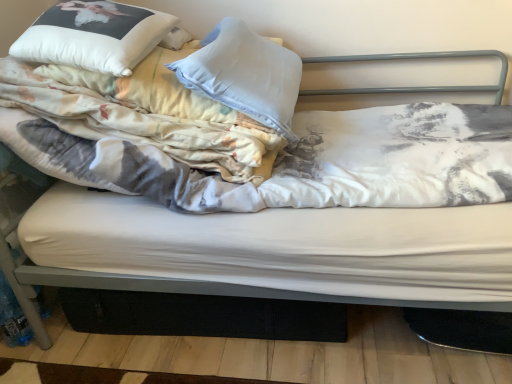
In order to face white soft pillow at upper left, acting as the 2th pillow starting from the left, should I rotate leftwards or rightwards?

Turn left by 0.674 degrees to look at white soft pillow at upper left, acting as the 2th pillow starting from the left.

Where is `printed cotton blanket at left`? This screenshot has height=384, width=512. printed cotton blanket at left is located at coordinates (145, 114).

Find the location of a particular element. The image size is (512, 384). white soft pillow at upper left, which is the 1th pillow from left to right is located at coordinates (93, 35).

Is white soft pillow at upper left, acting as the 2th pillow starting from the left, positioned far away from white soft pillow at upper left, which is the 2th pillow from right to left?

white soft pillow at upper left, acting as the 2th pillow starting from the left, is near white soft pillow at upper left, which is the 2th pillow from right to left, not far away.

Which object is positioned more to the left, white soft pillow at upper left, acting as the 2th pillow starting from the left, or white soft pillow at upper left, which is the 1th pillow from left to right?

white soft pillow at upper left, which is the 1th pillow from left to right.

Is white soft pillow at upper left, which is the 2th pillow from right to left, at the back of white soft pillow at upper left, acting as the 2th pillow starting from the left?

Yes, white soft pillow at upper left, acting as the 2th pillow starting from the left,'s orientation is away from white soft pillow at upper left, which is the 2th pillow from right to left.

Which is behind, point (249, 35) or point (102, 28)?

The point (249, 35) is more distant.

From a real-world perspective, is printed cotton blanket at left positioned above or below white soft pillow at upper left, acting as the 2th pillow starting from the left?

Clearly, from a real-world perspective, printed cotton blanket at left is below white soft pillow at upper left, acting as the 2th pillow starting from the left.

Is the surface of printed cotton blanket at left in direct contact with white soft pillow at upper left, acting as the 2th pillow starting from the left?

No, printed cotton blanket at left is not touching white soft pillow at upper left, acting as the 2th pillow starting from the left.

Is printed cotton blanket at left located outside white soft pillow at upper left, acting as the 2th pillow starting from the left?

Yes, printed cotton blanket at left is outside of white soft pillow at upper left, acting as the 2th pillow starting from the left.

Who is taller, white soft pillow at upper left, which is the 1th pillow from left to right, or printed cotton blanket at left?

Standing taller between the two is printed cotton blanket at left.

Looking at this image, between white soft pillow at upper left, which is the 1th pillow from left to right, and printed cotton blanket at left, which one has smaller size?

With smaller size is white soft pillow at upper left, which is the 1th pillow from left to right.

Between point (115, 60) and point (57, 66), which one is positioned in front?

The point (115, 60) is in front.

Is white soft pillow at upper left, which is the 2th pillow from right to left, not within printed cotton blanket at left?

No, white soft pillow at upper left, which is the 2th pillow from right to left, is not entirely external to printed cotton blanket at left.

Is white soft pillow at upper left, which is the 1th pillow from left to right, situated inside white soft pillow at upper left, acting as the 2th pillow starting from the left, or outside?

white soft pillow at upper left, which is the 1th pillow from left to right, cannot be found inside white soft pillow at upper left, acting as the 2th pillow starting from the left.

Considering the points (166, 16) and (233, 103), which point is behind, point (166, 16) or point (233, 103)?

The point (166, 16) is more distant.

Is white soft pillow at upper left, which is the 1th pillow from left to right, to the left of white soft pillow at upper left, marked as the 1th pillow in a right-to-left arrangement, from the viewer's perspective?

Yes, white soft pillow at upper left, which is the 1th pillow from left to right, is to the left of white soft pillow at upper left, marked as the 1th pillow in a right-to-left arrangement.

How distant is white soft pillow at upper left, acting as the 2th pillow starting from the left, from printed cotton blanket at left?

6.91 inches.

Is white soft pillow at upper left, acting as the 2th pillow starting from the left, in front of or behind printed cotton blanket at left in the image?

Clearly, white soft pillow at upper left, acting as the 2th pillow starting from the left, is behind printed cotton blanket at left.

Is white soft pillow at upper left, acting as the 2th pillow starting from the left, spatially inside printed cotton blanket at left, or outside of it?

white soft pillow at upper left, acting as the 2th pillow starting from the left, is located inside printed cotton blanket at left.

From the image's perspective, who appears lower, white soft pillow at upper left, acting as the 2th pillow starting from the left, or printed cotton blanket at left?

printed cotton blanket at left, from the image's perspective.

Is printed cotton blanket at left smaller than white soft pillow at upper left, which is the 2th pillow from right to left?

No.

Can you tell me how much printed cotton blanket at left and white soft pillow at upper left, which is the 2th pillow from right to left, differ in facing direction?

The angular difference between printed cotton blanket at left and white soft pillow at upper left, which is the 2th pillow from right to left, is 8.38 degrees.

From a real-world perspective, is printed cotton blanket at left on top of white soft pillow at upper left, which is the 2th pillow from right to left?

Actually, printed cotton blanket at left is physically below white soft pillow at upper left, which is the 2th pillow from right to left, in the real world.

At what (x,y) coordinates should I click in order to perform the action: click on pillow on the left side of white soft pillow at upper left, marked as the 1th pillow in a right-to-left arrangement. Please return your answer as a coordinate pair (x, y). Image resolution: width=512 pixels, height=384 pixels. Looking at the image, I should click on (93, 35).

You are a GUI agent. You are given a task and a screenshot of the screen. Output one action in this format:
    pyautogui.click(x=<x>, y=<y>)
    Task: Click on the 2nd pillow behind when counting from the printed cotton blanket at left
    This screenshot has height=384, width=512.
    Given the screenshot: What is the action you would take?
    pyautogui.click(x=245, y=74)

From the image, which object appears to be nearer to white soft pillow at upper left, which is the 1th pillow from left to right, printed cotton blanket at left or white soft pillow at upper left, marked as the 1th pillow in a right-to-left arrangement?

Among the two, printed cotton blanket at left is located nearer to white soft pillow at upper left, which is the 1th pillow from left to right.

When comparing their distances from white soft pillow at upper left, acting as the 2th pillow starting from the left, does printed cotton blanket at left or white soft pillow at upper left, which is the 1th pillow from left to right, seem further?

white soft pillow at upper left, which is the 1th pillow from left to right.

Based on their spatial positions, is white soft pillow at upper left, marked as the 1th pillow in a right-to-left arrangement, or white soft pillow at upper left, which is the 1th pillow from left to right, closer to printed cotton blanket at left?

The object closer to printed cotton blanket at left is white soft pillow at upper left, which is the 1th pillow from left to right.

Based on their spatial positions, is white soft pillow at upper left, which is the 2th pillow from right to left, or printed cotton blanket at left further from white soft pillow at upper left, acting as the 2th pillow starting from the left?

white soft pillow at upper left, which is the 2th pillow from right to left, is further to white soft pillow at upper left, acting as the 2th pillow starting from the left.

Considering their positions, is white soft pillow at upper left, marked as the 1th pillow in a right-to-left arrangement, positioned closer to white soft pillow at upper left, which is the 2th pillow from right to left, than printed cotton blanket at left?

printed cotton blanket at left is positioned closer to the anchor white soft pillow at upper left, which is the 2th pillow from right to left.

Looking at the image, which one is located further to printed cotton blanket at left, white soft pillow at upper left, which is the 1th pillow from left to right, or white soft pillow at upper left, marked as the 1th pillow in a right-to-left arrangement?

white soft pillow at upper left, marked as the 1th pillow in a right-to-left arrangement, is further to printed cotton blanket at left.

Where is `blanket located between white soft pillow at upper left, which is the 2th pillow from right to left, and white soft pillow at upper left, marked as the 1th pillow in a right-to-left arrangement, in the left-right direction`? blanket located between white soft pillow at upper left, which is the 2th pillow from right to left, and white soft pillow at upper left, marked as the 1th pillow in a right-to-left arrangement, in the left-right direction is located at coordinates (145, 114).